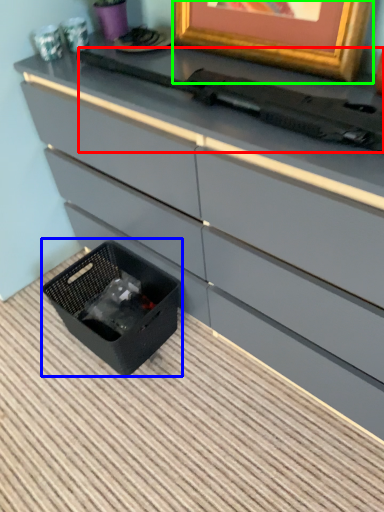
Question: Considering the real-world distances, which object is farthest from typewriter (highlighted by a red box)? storage box (highlighted by a blue box) or picture frame (highlighted by a green box)?

Choices:
 (A) storage box
 (B) picture frame

Answer: (A)